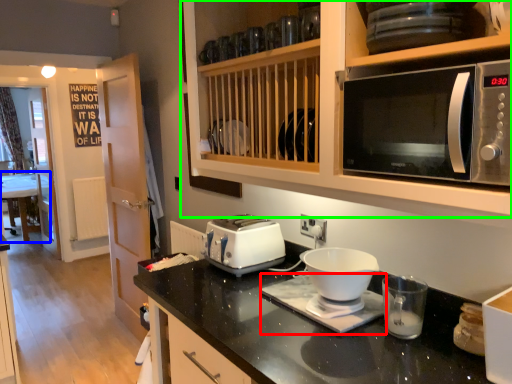
Question: Based on their relative distances, which object is farther from appliance (highlighted by a red box)? Choose from table (highlighted by a blue box) and cabinetry (highlighted by a green box).

Choices:
 (A) table
 (B) cabinetry

Answer: (A)